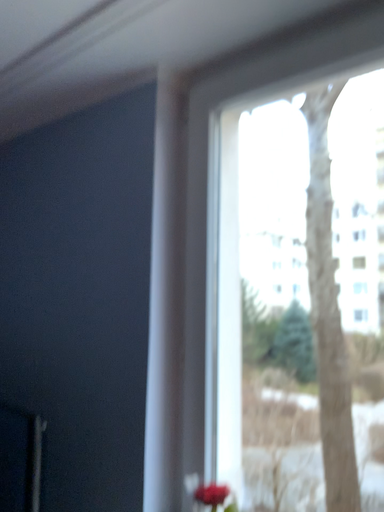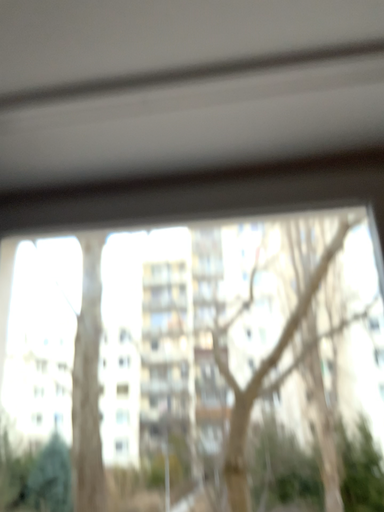
Question: How did the camera likely rotate when shooting the video?

Choices:
 (A) rotated upward
 (B) rotated downward

Answer: (A)